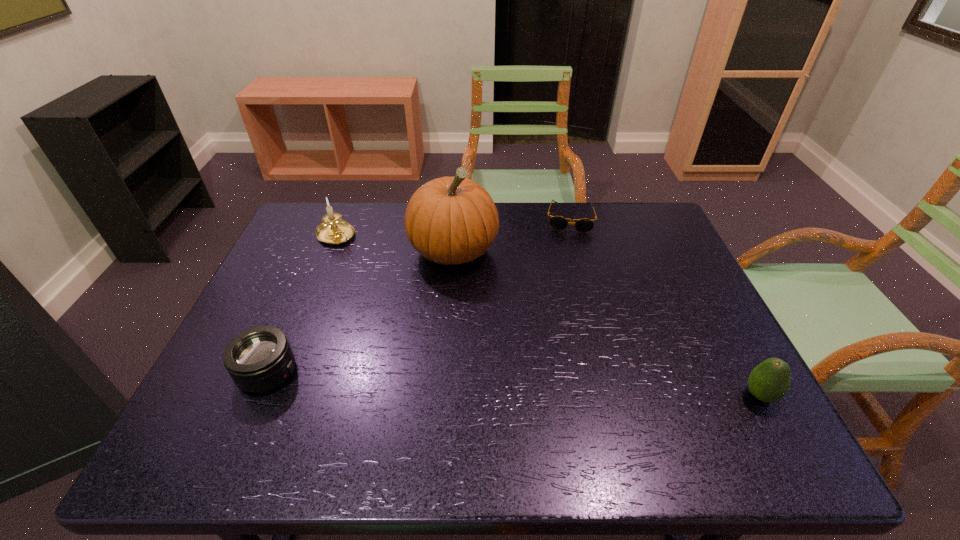
This screenshot has height=540, width=960. Find the location of `vacant space in between the sunglasses and the avocado`. vacant space in between the sunglasses and the avocado is located at coordinates (664, 307).

You are a GUI agent. You are given a task and a screenshot of the screen. Output one action in this format:
    pyautogui.click(x=<x>, y=<y>)
    Task: Click on the free space between the rightmost object and the shortest object
    
    Given the screenshot: What is the action you would take?
    pyautogui.click(x=664, y=307)

Image resolution: width=960 pixels, height=540 pixels. In order to click on free space between the shortest object and the pumpkin in this screenshot , I will do `click(511, 234)`.

I want to click on empty location between the second tallest object and the second shortest object, so click(302, 303).

Find the location of a particular element. This screenshot has height=540, width=960. vacant area that lies between the pumpkin and the fourth shortest object is located at coordinates (395, 243).

Where is `unoccupied position between the third shortest object and the candle holder`? The width and height of the screenshot is (960, 540). unoccupied position between the third shortest object and the candle holder is located at coordinates (548, 315).

This screenshot has width=960, height=540. What are the coordinates of `free point between the third shortest object and the telephoto lens` in the screenshot? It's located at (514, 384).

Locate an element on the screen. This screenshot has height=540, width=960. the fourth closest object to the sunglasses is located at coordinates (258, 359).

Image resolution: width=960 pixels, height=540 pixels. I want to click on object identified as the fourth closest to the shortest object, so click(x=258, y=359).

Where is `vacant area that satisfies the following two spatial constraints: 1. on the front side of the third object from left to right; 2. on the left side of the candle holder`? The image size is (960, 540). vacant area that satisfies the following two spatial constraints: 1. on the front side of the third object from left to right; 2. on the left side of the candle holder is located at coordinates (329, 251).